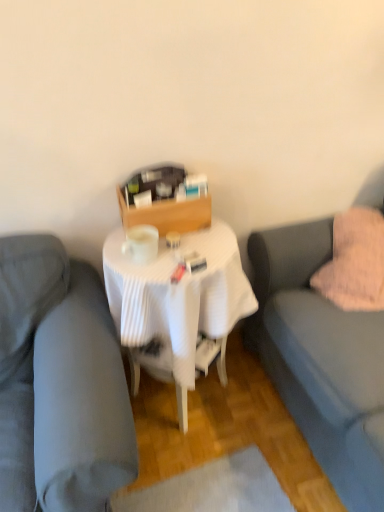
What are the coordinates of `vacant space situated above white pleated tablecloth at center (from a real-world perspective)` in the screenshot? It's located at (x=179, y=251).